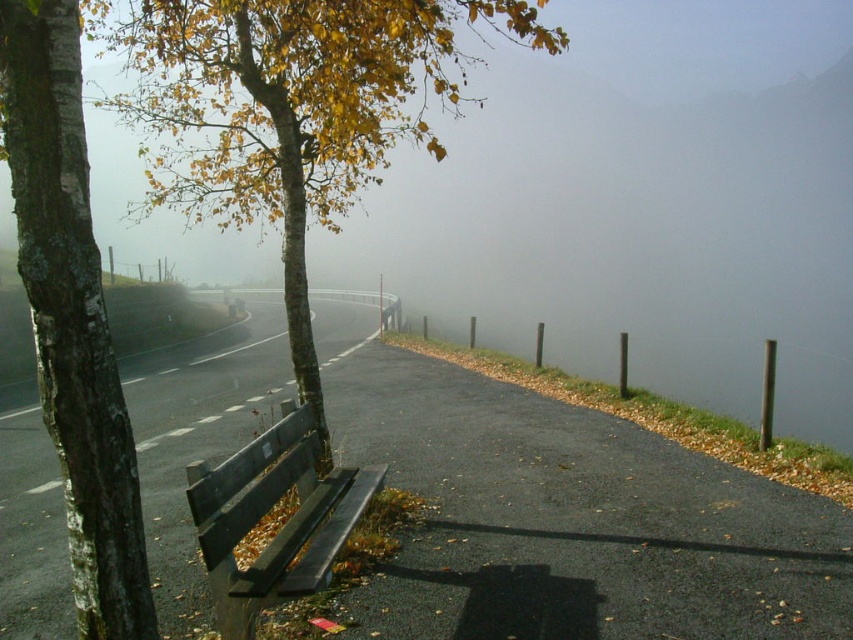
Question: Is dark gray asphalt road at center thinner than smooth bark tree at left?

Choices:
 (A) no
 (B) yes

Answer: (A)

Question: Is yellow-green leafy tree at left to the right of wooden bench at lower left from the viewer's perspective?

Choices:
 (A) yes
 (B) no

Answer: (B)

Question: Which object is the farthest from the smooth bark tree at left?

Choices:
 (A) dark gray asphalt road at center
 (B) yellow-green leafy tree at left
 (C) wooden bench at lower left

Answer: (B)

Question: Does smooth bark tree at left have a larger size compared to wooden bench at lower left?

Choices:
 (A) yes
 (B) no

Answer: (B)

Question: Which of the following is the farthest from the observer?

Choices:
 (A) smooth bark tree at left
 (B) wooden bench at lower left
 (C) dark gray asphalt road at center

Answer: (C)

Question: Which point is farther to the camera?

Choices:
 (A) wooden bench at lower left
 (B) smooth bark tree at left
 (C) yellow-green leafy tree at left
 (D) dark gray asphalt road at center

Answer: (C)